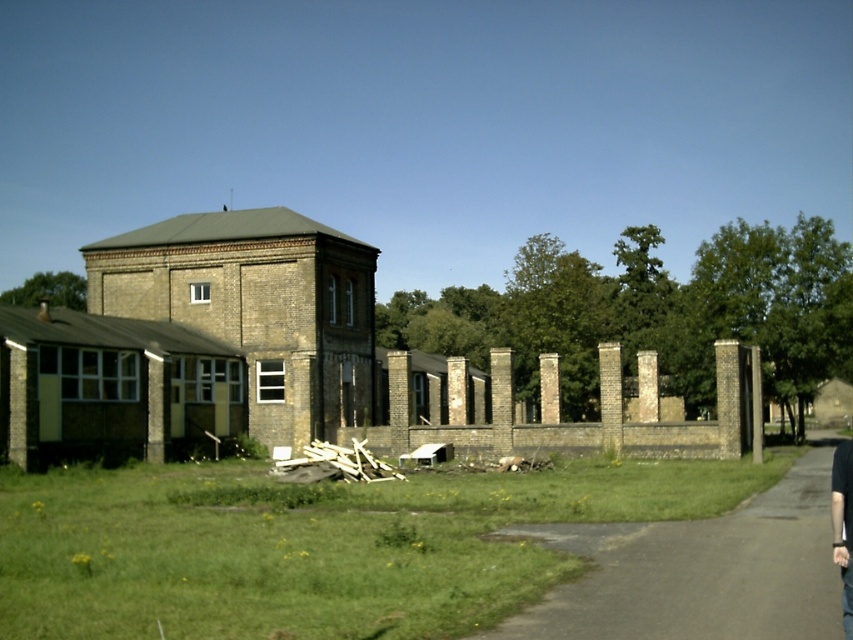
Question: Does wooden planks at center lie behind black fabric pants at lower right?

Choices:
 (A) yes
 (B) no

Answer: (A)

Question: Which object appears closest to the camera in this image?

Choices:
 (A) wooden planks at center
 (B) black fabric pants at lower right

Answer: (B)

Question: Does wooden planks at center come behind black fabric pants at lower right?

Choices:
 (A) yes
 (B) no

Answer: (A)

Question: Is wooden planks at center wider than black fabric pants at lower right?

Choices:
 (A) no
 (B) yes

Answer: (A)

Question: Which point appears farthest from the camera in this image?

Choices:
 (A) (836, 552)
 (B) (329, 474)

Answer: (B)